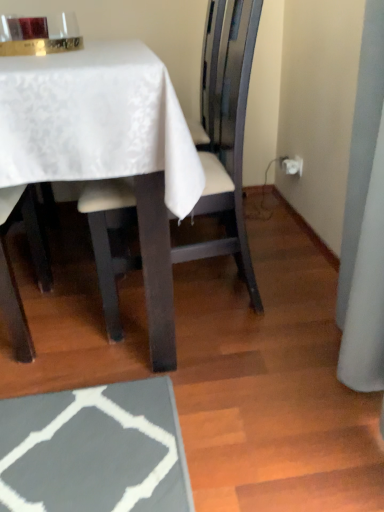
This screenshot has height=512, width=384. I want to click on vacant space in front of white leather chair at center, so click(x=175, y=395).